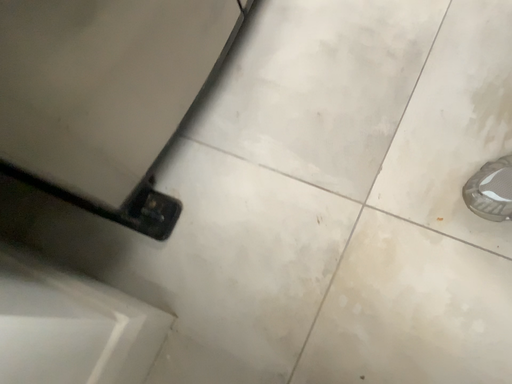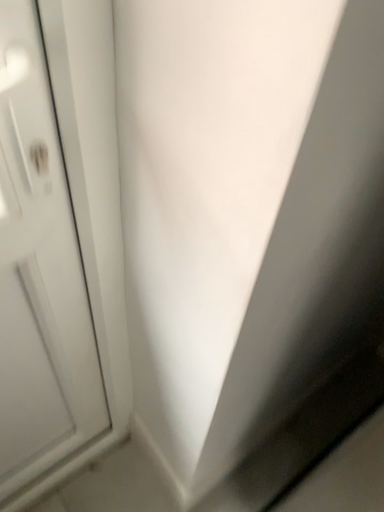
Question: How did the camera likely rotate when shooting the video?

Choices:
 (A) rotated downward
 (B) rotated upward

Answer: (B)